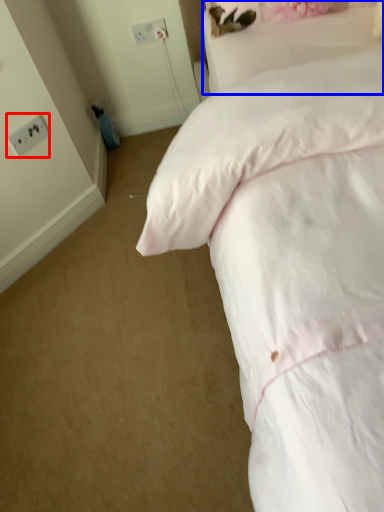
Question: Which point is further to the camera, electric outlet (highlighted by a red box) or pillow (highlighted by a blue box)?

Choices:
 (A) electric outlet
 (B) pillow

Answer: (A)